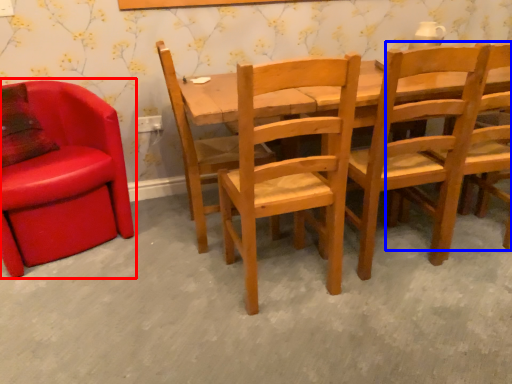
Question: Which object appears closest to the camera in this image, chair (highlighted by a red box) or chair (highlighted by a blue box)?

Choices:
 (A) chair
 (B) chair

Answer: (B)